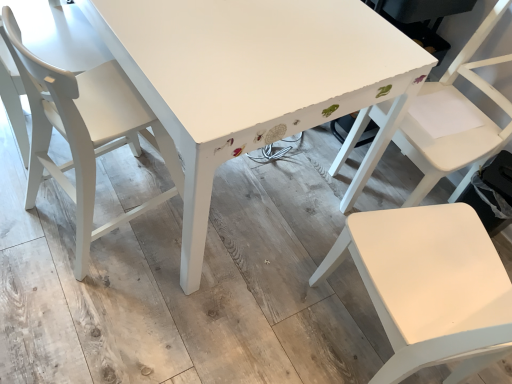
This screenshot has width=512, height=384. What are the coordinates of `vacant region below matte white chair at left, which is the 1th chair from left to right (from a real-world perspective)` in the screenshot? It's located at (74, 210).